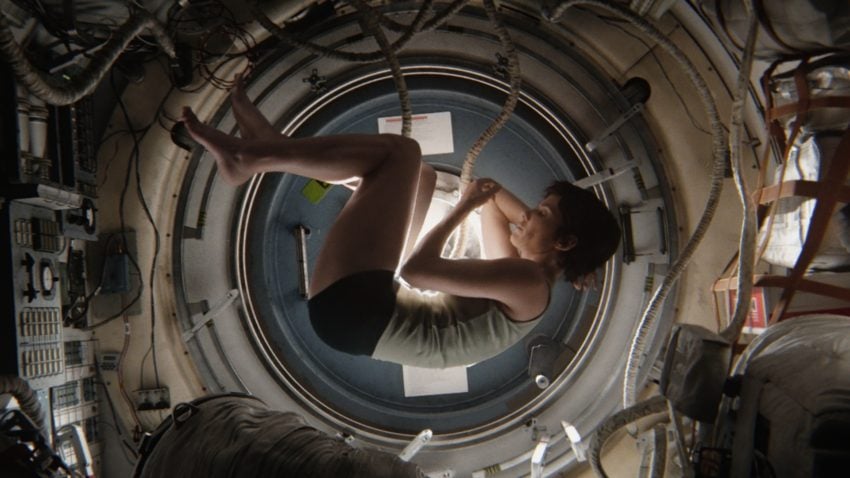
Find the location of a particular element. The image size is (850, 478). lighter part of grey door is located at coordinates (195, 220).